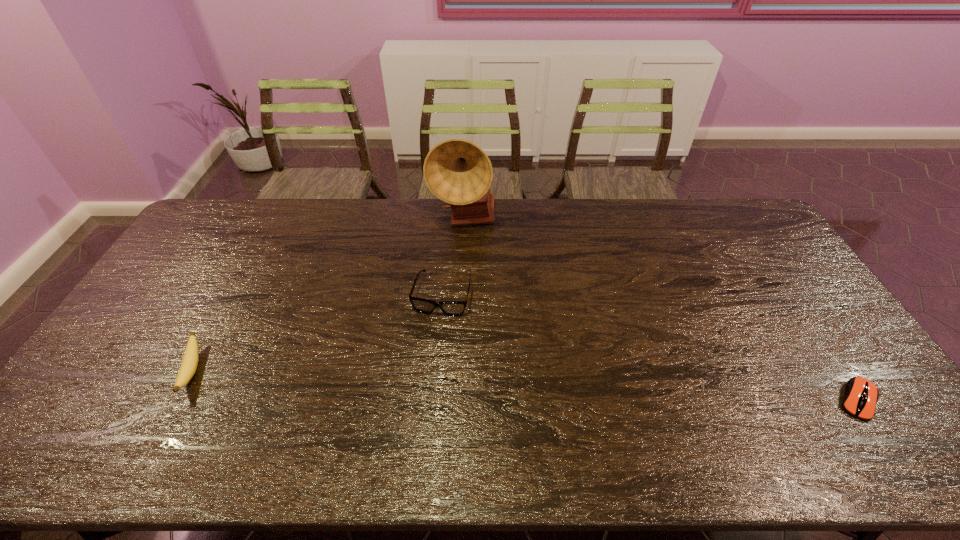
I want to click on free spot between the second farthest object and the leftmost object, so click(317, 333).

What are the coordinates of `free space between the sunglasses and the leftmost object` in the screenshot? It's located at (317, 333).

The width and height of the screenshot is (960, 540). In order to click on empty space that is in between the third tallest object and the phonograph record in this screenshot , I will do `click(328, 295)`.

Image resolution: width=960 pixels, height=540 pixels. In order to click on free spot between the rightmost object and the tallest object in this screenshot , I will do `click(660, 310)`.

The height and width of the screenshot is (540, 960). What are the coordinates of `empty location between the leftmost object and the tallest object` in the screenshot? It's located at (328, 295).

Find the location of a particular element. vacant area that lies between the computer mouse and the farthest object is located at coordinates (660, 310).

Where is `the closest object relative to the phonograph record`? the closest object relative to the phonograph record is located at coordinates pyautogui.click(x=450, y=308).

Locate which object ranks second in proximity to the farthest object. Please provide its 2D coordinates. Your answer should be formatted as a tuple, i.e. [(x, y)], where the tuple contains the x and y coordinates of a point satisfying the conditions above.

[(188, 367)]

The width and height of the screenshot is (960, 540). What are the coordinates of `vacant area that satisfies the following two spatial constraints: 1. on the back side of the sunglasses; 2. on the left side of the leftmost object` in the screenshot? It's located at (232, 295).

You are a GUI agent. You are given a task and a screenshot of the screen. Output one action in this format:
    pyautogui.click(x=<x>, y=<y>)
    Task: Click on the free spot that satisfies the following two spatial constraints: 1. on the front side of the second farthest object; 2. on the left side of the computer mouse
    
    Given the screenshot: What is the action you would take?
    pyautogui.click(x=433, y=400)